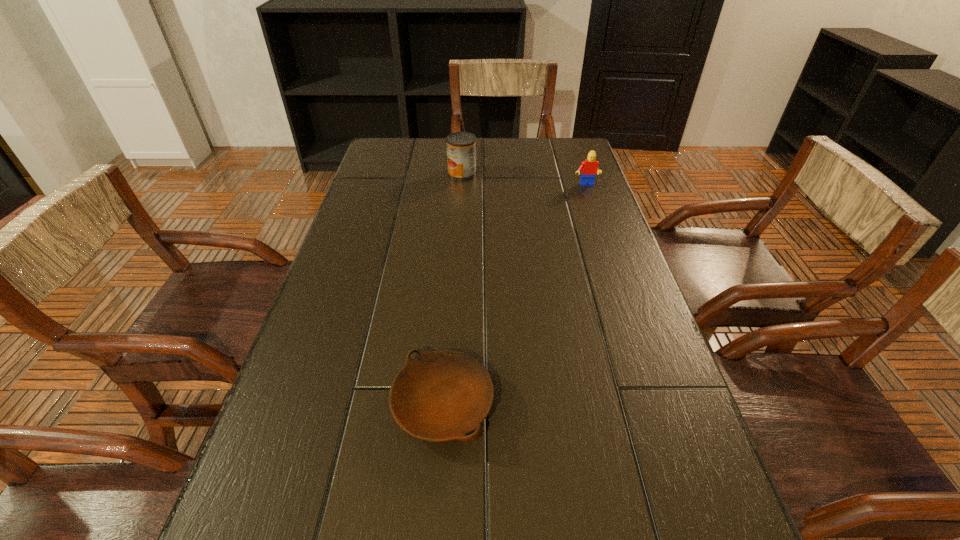
I want to click on vacant position at the far edge of the desktop, so click(x=499, y=165).

Locate an element on the screen. The height and width of the screenshot is (540, 960). vacant area at the left edge of the desktop is located at coordinates (350, 360).

In the image, there is a desktop. Find the location of `free region at the right edge`. free region at the right edge is located at coordinates (575, 285).

This screenshot has height=540, width=960. In order to click on free region at the far left corner of the desktop in this screenshot , I will do `click(420, 143)`.

I want to click on vacant space in between the plate and the second farthest object, so click(x=515, y=294).

Image resolution: width=960 pixels, height=540 pixels. I want to click on empty space between the Lego and the shortest object, so click(515, 294).

The image size is (960, 540). In order to click on free area in between the nearest object and the farthest object in this screenshot , I will do `click(452, 288)`.

Identify the location of vacant space that's between the Lego and the nearest object. This screenshot has height=540, width=960. (515, 294).

Locate an element on the screen. blank region between the farthest object and the plate is located at coordinates (452, 288).

Locate an element on the screen. The width and height of the screenshot is (960, 540). blank region between the nearest object and the Lego is located at coordinates (515, 294).